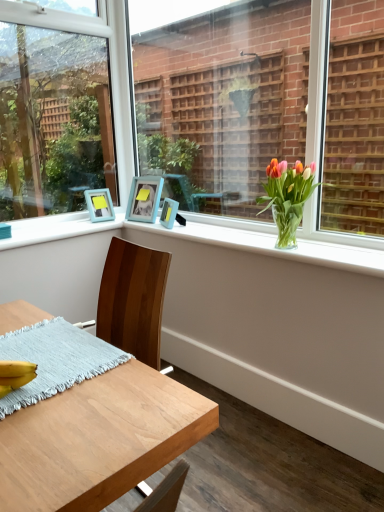
You are a GUI agent. You are given a task and a screenshot of the screen. Output one action in this format:
    pyautogui.click(x=<x>, y=<y>)
    Task: Click on the translucent glass vase at upper right
    This screenshot has height=512, width=384.
    Given the screenshot: What is the action you would take?
    pyautogui.click(x=287, y=197)

Where is `clear glass window at upper left, which appears as the 2th window when viewed from the right`? Image resolution: width=384 pixels, height=512 pixels. clear glass window at upper left, which appears as the 2th window when viewed from the right is located at coordinates (53, 120).

This screenshot has width=384, height=512. What do you see at coordinates (98, 439) in the screenshot?
I see `wooden desk at lower left` at bounding box center [98, 439].

Consider the image. Measure the distance between matte blue picture frame at upper center, which ranks as the 3th picture frame in left-to-right order, and camera.

matte blue picture frame at upper center, which ranks as the 3th picture frame in left-to-right order, is 7.50 feet from camera.

Where is `translucent glass vase at upper right`? Image resolution: width=384 pixels, height=512 pixels. translucent glass vase at upper right is located at coordinates (287, 197).

Does teal wooden picture frame at upper left, the first picture frame viewed from the left, have a lesser width compared to wooden desk at lower left?

Indeed, teal wooden picture frame at upper left, the first picture frame viewed from the left, has a lesser width compared to wooden desk at lower left.

From a real-world perspective, starting from the wooden desk at lower left, which picture frame is the 2nd one vertically above it? Please provide its 2D coordinates.

[(99, 205)]

Is point (93, 194) closer or farther from the camera than point (155, 459)?

Point (93, 194) is positioned farther from the camera compared to point (155, 459).

Would you say wooden desk at lower left is to the left or to the right of matte blue picture frame at upper center, which ranks as the 3th picture frame in left-to-right order, in the picture?

wooden desk at lower left is to the left of matte blue picture frame at upper center, which ranks as the 3th picture frame in left-to-right order.

How many degrees apart are the facing directions of wooden desk at lower left and matte blue picture frame at upper center, which is the 1th picture frame in right-to-left order?

There is a 24.5-degree angle between the facing directions of wooden desk at lower left and matte blue picture frame at upper center, which is the 1th picture frame in right-to-left order.

From the picture: Is wooden desk at lower left further to camera compared to matte blue picture frame at upper center, which ranks as the 3th picture frame in left-to-right order?

No.

Considering the relative sizes of wooden desk at lower left and matte blue picture frame at upper center, which is the 1th picture frame in right-to-left order, in the image provided, is wooden desk at lower left bigger than matte blue picture frame at upper center, which is the 1th picture frame in right-to-left order,?

Correct, wooden desk at lower left is larger in size than matte blue picture frame at upper center, which is the 1th picture frame in right-to-left order.

From the image's perspective, is teal wooden picture frame at upper left, which appears as the third picture frame when viewed from the right, on top of clear glass vase at upper center?

Yes.

Between teal wooden picture frame at upper left, which appears as the third picture frame when viewed from the right, and clear glass vase at upper center, which one has larger width?

clear glass vase at upper center.

Is teal wooden picture frame at upper left, which appears as the third picture frame when viewed from the right, not near clear glass vase at upper center?

No, teal wooden picture frame at upper left, which appears as the third picture frame when viewed from the right, is not far from clear glass vase at upper center.

From a real-world perspective, which is physically above, teal wooden picture frame at upper left, the first picture frame viewed from the left, or clear glass vase at upper center?

teal wooden picture frame at upper left, the first picture frame viewed from the left.

Are blue woven placemat at lower left and wooden desk at lower left far apart?

No, blue woven placemat at lower left is not far from wooden desk at lower left.

Which point is more forward, (123, 362) or (83, 481)?

Positioned in front is point (83, 481).

From a real-world perspective, who is located higher, blue woven placemat at lower left or wooden desk at lower left?

Result: wooden desk at lower left, from a real-world perspective.

Which of these two, blue woven placemat at lower left or wooden desk at lower left, is wider?

wooden desk at lower left is wider.

In the scene shown: From their relative heights in the image, would you say wooden desk at lower left is taller or shorter than blue woven placemat at lower left?

Considering their sizes, wooden desk at lower left has more height than blue woven placemat at lower left.

The width and height of the screenshot is (384, 512). Identify the location of blanket below the wooden desk at lower left (from the image's perspective). (55, 360).

Based on the photo, is wooden desk at lower left facing away from blue woven placemat at lower left?

Yes.

Is blue matte picture frame at upper center, the second picture frame viewed from the left, positioned with its back to clear glass window at upper left, which is counted as the first window, starting from the left?

No, blue matte picture frame at upper center, the second picture frame viewed from the left, is not facing the opposite direction of clear glass window at upper left, which is counted as the first window, starting from the left.

From a real-world perspective, is blue matte picture frame at upper center, which appears as the 2th picture frame when viewed from the right, physically above clear glass window at upper left, which is counted as the first window, starting from the left?

No, from a real-world perspective, blue matte picture frame at upper center, which appears as the 2th picture frame when viewed from the right, is not over clear glass window at upper left, which is counted as the first window, starting from the left

Can you tell me how much blue matte picture frame at upper center, which appears as the 2th picture frame when viewed from the right, and clear glass window at upper left, which appears as the 2th window when viewed from the right, differ in facing direction?

77.7 degrees.

From the image's perspective, would you say teal wooden picture frame at upper left, which appears as the third picture frame when viewed from the right, is positioned over translucent glass vase at upper right?

Yes, from the image's perspective, teal wooden picture frame at upper left, which appears as the third picture frame when viewed from the right, is over translucent glass vase at upper right.

Considering the sizes of objects teal wooden picture frame at upper left, which appears as the third picture frame when viewed from the right, and translucent glass vase at upper right in the image provided, who is taller, teal wooden picture frame at upper left, which appears as the third picture frame when viewed from the right, or translucent glass vase at upper right?

With more height is translucent glass vase at upper right.

Which object is further away from the camera taking this photo, teal wooden picture frame at upper left, which appears as the third picture frame when viewed from the right, or translucent glass vase at upper right?

teal wooden picture frame at upper left, which appears as the third picture frame when viewed from the right.

Identify the location of desk below the teal wooden picture frame at upper left, the first picture frame viewed from the left (from a real-world perspective). (98, 439).

The height and width of the screenshot is (512, 384). Identify the location of desk on the left of matte blue picture frame at upper center, which is the 1th picture frame in right-to-left order. (98, 439).

Considering their positions, is blue matte picture frame at upper center, the second picture frame viewed from the left, positioned further to translucent glass vase at upper right than clear glass window at upper left, which is counted as the first window, starting from the left?

clear glass window at upper left, which is counted as the first window, starting from the left, lies further to translucent glass vase at upper right than the other object.

Based on their spatial positions, is clear glass window at upper left, which is counted as the first window, starting from the left, or translucent glass vase at upper right further from teal wooden picture frame at upper left, which appears as the third picture frame when viewed from the right?

clear glass window at upper left, which is counted as the first window, starting from the left, is further to teal wooden picture frame at upper left, which appears as the third picture frame when viewed from the right.

Estimate the real-world distances between objects in this image. Which object is further from wooden desk at lower left, clear glass window at upper left, which appears as the 2th window when viewed from the right, or clear glass vase at center, which is the 2th window in left-to-right order?

clear glass window at upper left, which appears as the 2th window when viewed from the right, is positioned further to the anchor wooden desk at lower left.

When comparing their distances from teal wooden picture frame at upper left, the first picture frame viewed from the left, does clear glass vase at center, which is the 2th window in left-to-right order, or blue matte picture frame at upper center, which appears as the 2th picture frame when viewed from the right, seem closer?

Among the two, blue matte picture frame at upper center, which appears as the 2th picture frame when viewed from the right, is located nearer to teal wooden picture frame at upper left, the first picture frame viewed from the left.

From the image, which object appears to be farther from wooden desk at lower left, translucent glass vase at upper right or clear glass window at upper left, which appears as the 2th window when viewed from the right?

The object further to wooden desk at lower left is clear glass window at upper left, which appears as the 2th window when viewed from the right.

Which object lies further to the anchor point wooden desk at lower left, clear glass vase at upper center or blue woven placemat at lower left?

clear glass vase at upper center is positioned further to the anchor wooden desk at lower left.

When comparing their distances from matte blue picture frame at upper center, which ranks as the 3th picture frame in left-to-right order, does translucent glass vase at upper right or clear glass vase at upper center seem further?

translucent glass vase at upper right is positioned further to the anchor matte blue picture frame at upper center, which ranks as the 3th picture frame in left-to-right order.

When comparing their distances from blue woven placemat at lower left, does clear glass vase at upper center or teal wooden picture frame at upper left, the first picture frame viewed from the left, seem closer?

clear glass vase at upper center is closer to blue woven placemat at lower left.

This screenshot has width=384, height=512. Find the location of `window sill situated between blue woven placemat at lower left and translucent glass vase at upper right from left to right`. window sill situated between blue woven placemat at lower left and translucent glass vase at upper right from left to right is located at coordinates (213, 239).

At what (x,y) coordinates should I click in order to perform the action: click on window that lies between clear glass window at upper left, which appears as the 2th window when viewed from the right, and wooden desk at lower left from top to bottom. Please return your answer as a coordinate pair (x, y). Looking at the image, I should click on (198, 111).

Where is `picture frame positioned between clear glass vase at upper center and blue matte picture frame at upper center, the second picture frame viewed from the left, from near to far`? Image resolution: width=384 pixels, height=512 pixels. picture frame positioned between clear glass vase at upper center and blue matte picture frame at upper center, the second picture frame viewed from the left, from near to far is located at coordinates (169, 213).

Find the location of a particular element. window sill between clear glass window at upper left, which appears as the 2th window when viewed from the right, and wooden desk at lower left, in the vertical direction is located at coordinates (213, 239).